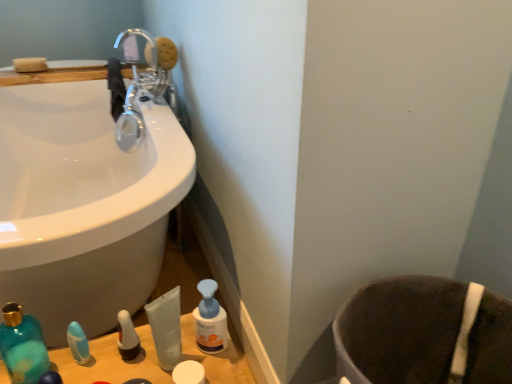
Identify the location of free space to the left of translucent plastic tube at lower center, the 3th toiletry viewed from the left. This screenshot has width=512, height=384. (115, 362).